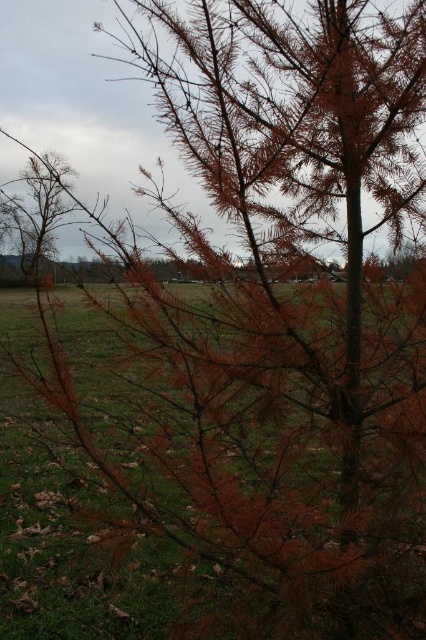
You are standing in front of the tree and want to determine which of the two points, point (x=94, y=401) or point (x=49, y=262), is nearer to you. Based on the tree and field layout, which point is closer?

Point (x=94, y=401) is closer to the viewer than point (x=49, y=262).

You are a park ranger planning to plant a new tree that requires at least 20 meters of space between it and any existing trees to thrive. You see the brown matte tree at center and the brown bark tree at left in the image. Can you plant the new tree between them without violating the spacing requirement?

The distance between the brown matte tree at center and the brown bark tree at left is 18.27 meters, which is less than the required 20 meters. Therefore, planting a new tree between them would not meet the spacing requirement.

You are a botanist examining two trees in a field. You see the brown matte tree at center and the brown bark tree at left. Which tree is shorter?

The brown matte tree at center is shorter than the brown bark tree at left.